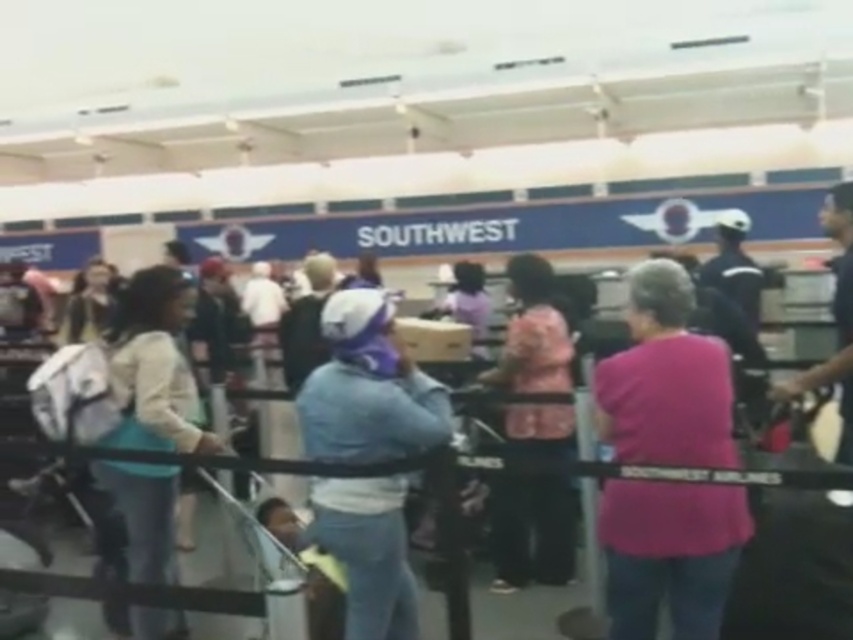
Question: Which point is closer to the camera?

Choices:
 (A) (99, 317)
 (B) (378, 390)
 (C) (553, 560)

Answer: (B)

Question: Does purple fleece hat at center appear under pink fabric purse at center?

Choices:
 (A) yes
 (B) no

Answer: (A)

Question: Does pink fabric shirt at center have a lesser width compared to pink fabric purse at center?

Choices:
 (A) yes
 (B) no

Answer: (B)

Question: Which point is farther from the camera taking this photo?

Choices:
 (A) (331, 435)
 (B) (163, 404)
 (C) (99, 328)
 (D) (659, 326)

Answer: (C)

Question: Which point appears closest to the camera in this image?

Choices:
 (A) (155, 436)
 (B) (74, 285)

Answer: (A)

Question: Is pink fabric shirt at center to the right of purple fleece hat at center from the viewer's perspective?

Choices:
 (A) no
 (B) yes

Answer: (B)